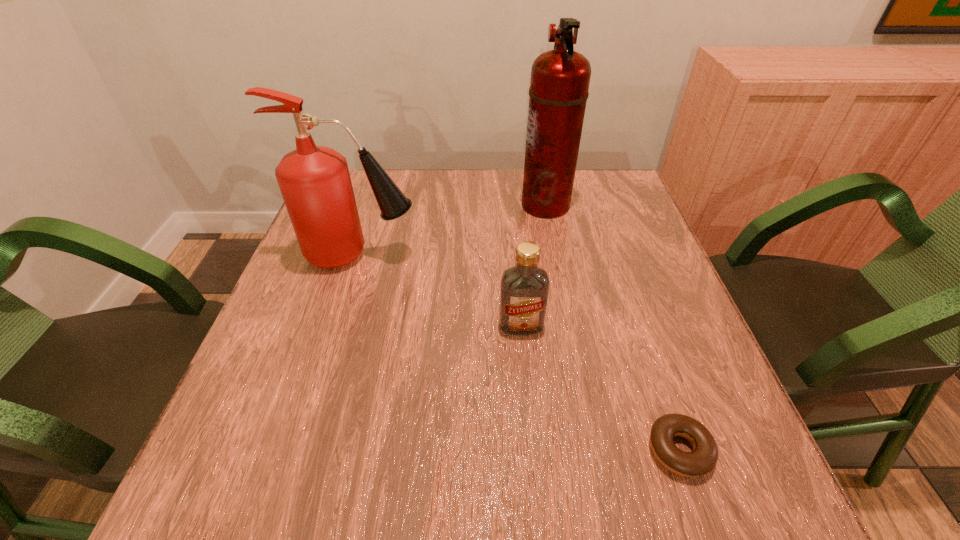
Where is `free location that satisfies the following two spatial constraints: 1. on the nozzle side of the tallest object; 2. on the front-facing side of the second nearest object`? This screenshot has width=960, height=540. free location that satisfies the following two spatial constraints: 1. on the nozzle side of the tallest object; 2. on the front-facing side of the second nearest object is located at coordinates (568, 325).

At what (x,y) coordinates should I click in order to perform the action: click on free space that satisfies the following two spatial constraints: 1. on the nozzle side of the taller fire extinguisher; 2. on the right side of the nearest object. Please return your answer as a coordinate pair (x, y). This screenshot has height=540, width=960. Looking at the image, I should click on (592, 450).